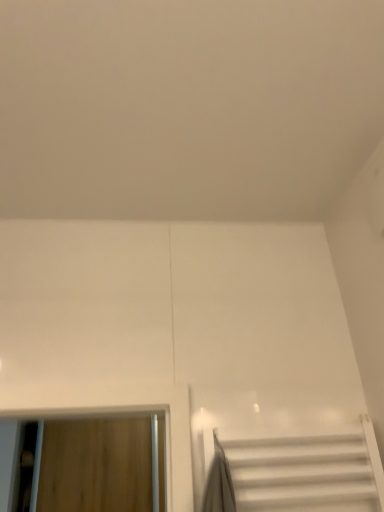
Question: Is wooden door at left positioned far away from white glossy stairs at lower right?

Choices:
 (A) yes
 (B) no

Answer: (A)

Question: Is wooden door at left turned away from white glossy stairs at lower right?

Choices:
 (A) yes
 (B) no

Answer: (B)

Question: Is wooden door at left not inside white glossy stairs at lower right?

Choices:
 (A) yes
 (B) no

Answer: (A)

Question: From a real-world perspective, is wooden door at left positioned over white glossy stairs at lower right based on gravity?

Choices:
 (A) yes
 (B) no

Answer: (A)

Question: Is wooden door at left next to white glossy stairs at lower right and touching it?

Choices:
 (A) no
 (B) yes

Answer: (A)

Question: Does wooden door at left lie in front of white glossy stairs at lower right?

Choices:
 (A) no
 (B) yes

Answer: (A)

Question: Is white glossy stairs at lower right surrounding wooden door at left?

Choices:
 (A) yes
 (B) no

Answer: (B)

Question: Is white glossy stairs at lower right positioned with its back to wooden door at left?

Choices:
 (A) no
 (B) yes

Answer: (B)

Question: Considering the relative sizes of white glossy stairs at lower right and wooden door at left in the image provided, is white glossy stairs at lower right bigger than wooden door at left?

Choices:
 (A) yes
 (B) no

Answer: (B)

Question: Can you confirm if white glossy stairs at lower right is smaller than wooden door at left?

Choices:
 (A) yes
 (B) no

Answer: (A)

Question: Does white glossy stairs at lower right have a lesser width compared to wooden door at left?

Choices:
 (A) no
 (B) yes

Answer: (B)

Question: Does white glossy stairs at lower right have a greater height compared to wooden door at left?

Choices:
 (A) no
 (B) yes

Answer: (A)

Question: Is white glossy stairs at lower right in front of or behind wooden door at left in the image?

Choices:
 (A) behind
 (B) front

Answer: (B)